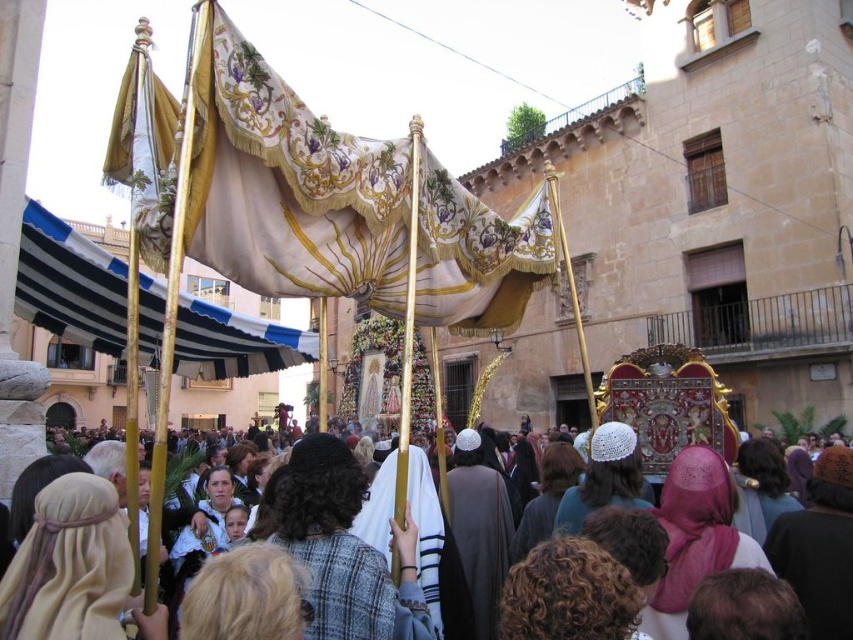
Is point (257, 180) closer to camera compared to point (105, 323)?

Yes, it is.

Is gold embroidered canopy at center thinner than blue and white striped fabric at left?

Correct, gold embroidered canopy at center's width is less than blue and white striped fabric at left's.

Identify the location of gold embroidered canopy at center. (289, 186).

Is gold embroidered canopy at center smaller than white woolen shawl at center?

Yes, gold embroidered canopy at center is smaller than white woolen shawl at center.

Measure the distance between point (x=503, y=288) and camera.

A distance of 43.78 meters exists between point (x=503, y=288) and camera.

The height and width of the screenshot is (640, 853). I want to click on gold embroidered canopy at center, so pos(289,186).

Does white woolen shawl at center come in front of gold embroidered flag at upper left?

Yes, it is.

Does white woolen shawl at center appear on the left side of gold embroidered flag at upper left?

No, white woolen shawl at center is not to the left of gold embroidered flag at upper left.

Where is `white woolen shawl at center`? Image resolution: width=853 pixels, height=640 pixels. white woolen shawl at center is located at coordinates (693, 524).